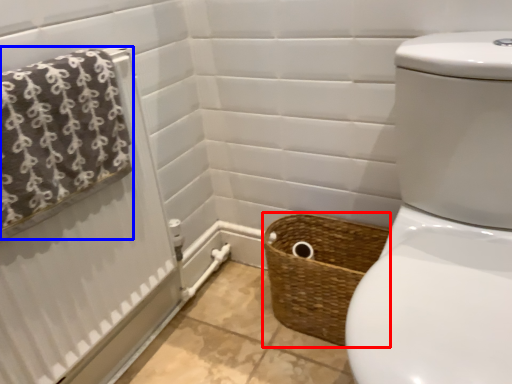
Question: Among these objects, which one is farthest to the camera, basket (highlighted by a red box) or bath towel (highlighted by a blue box)?

Choices:
 (A) basket
 (B) bath towel

Answer: (A)